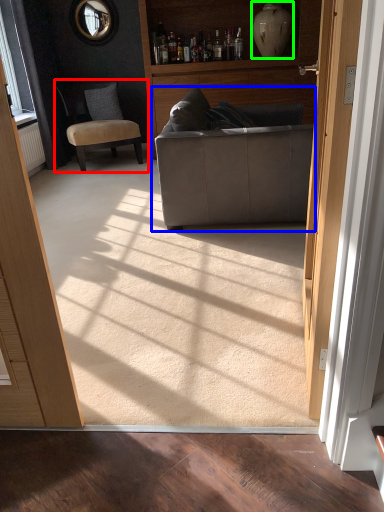
Question: Which is nearer to the chair (highlighted by a red box)? studio couch (highlighted by a blue box) or vase (highlighted by a green box).

Choices:
 (A) studio couch
 (B) vase

Answer: (B)